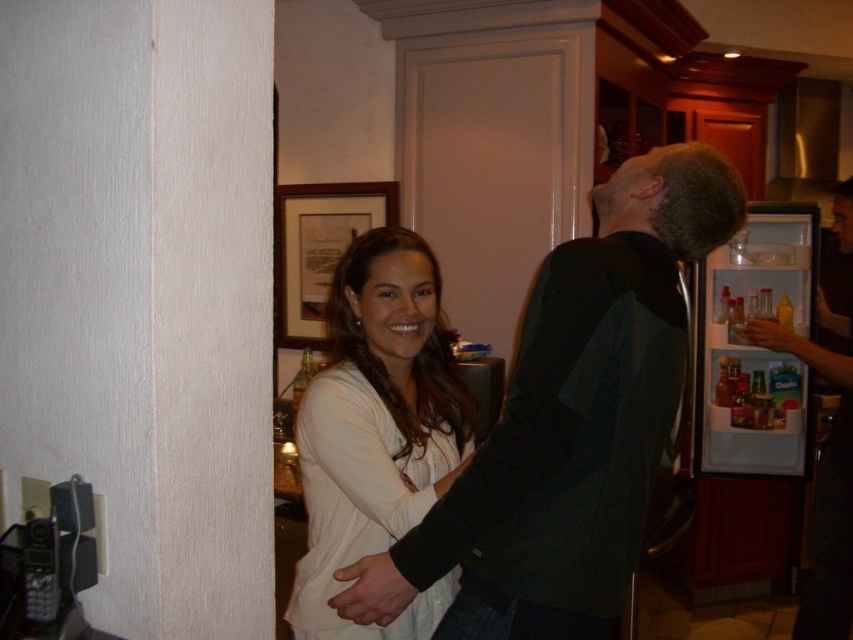
Question: Among these points, which one is farthest from the camera?

Choices:
 (A) (848, 529)
 (B) (552, 486)
 (C) (321, 456)
 (D) (780, 364)

Answer: (D)

Question: Which point is farther from the camera taking this photo?

Choices:
 (A) (845, 196)
 (B) (338, 355)
 (C) (285, 230)

Answer: (C)

Question: Is dark green sweater at center smaller than white plastic refrigerator at right?

Choices:
 (A) yes
 (B) no

Answer: (A)

Question: Is white matte shirt at center bigger than white plastic refrigerator at right?

Choices:
 (A) yes
 (B) no

Answer: (B)

Question: Which of these objects is positioned closest to the white matte shirt at center?

Choices:
 (A) dark green sweater at center
 (B) wooden frame at upper center
 (C) white plastic refrigerator at right
 (D) dark green sweater at right

Answer: (A)

Question: Is white matte shirt at center above dark green sweater at right?

Choices:
 (A) yes
 (B) no

Answer: (A)